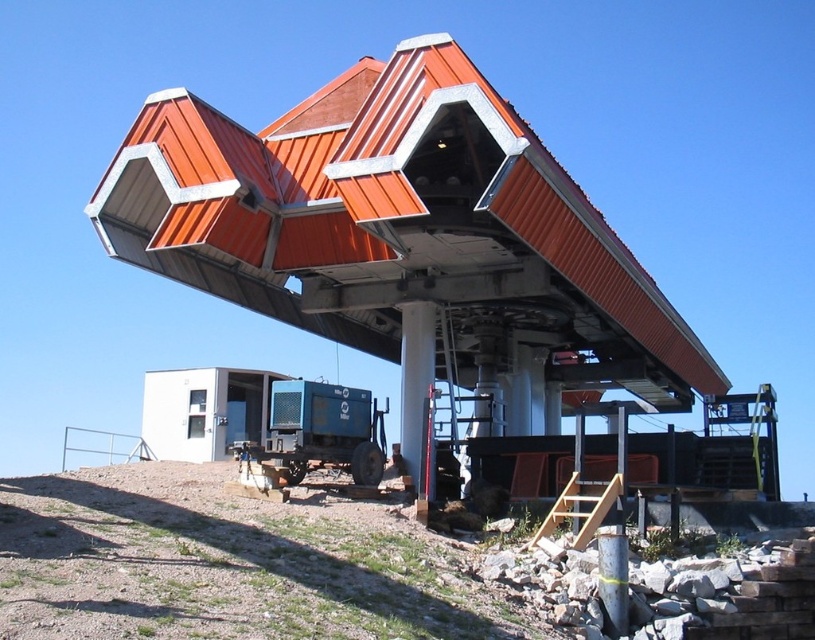
Question: Which object appears closest to the camera in this image?

Choices:
 (A) white smooth pillar at center
 (B) metallic orange roof at upper center

Answer: (B)

Question: Among these objects, which one is farthest from the camera?

Choices:
 (A) metallic orange roof at upper center
 (B) white smooth pillar at center

Answer: (B)

Question: Is blue metallic train car at lower center wider than white smooth pillar at center?

Choices:
 (A) no
 (B) yes

Answer: (B)

Question: Observing the image, what is the correct spatial positioning of blue metallic train car at lower center in reference to white smooth pillar at center?

Choices:
 (A) right
 (B) left

Answer: (B)

Question: Which point is farther to the camera?

Choices:
 (A) (210, 138)
 (B) (401, 433)
 (C) (351, 442)

Answer: (B)

Question: Can you confirm if metallic orange roof at upper center is wider than white smooth pillar at center?

Choices:
 (A) yes
 (B) no

Answer: (A)